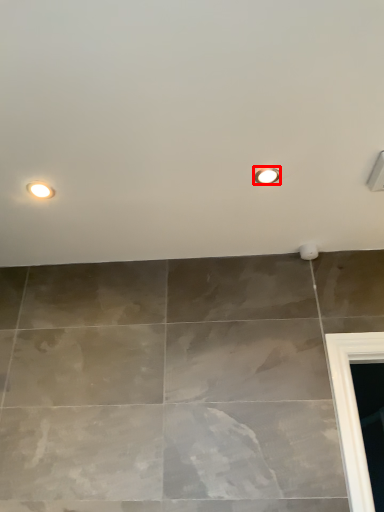
Question: From the image's perspective, what is the correct spatial relationship of droplight (annotated by the red box) in relation to droplight?

Choices:
 (A) above
 (B) below

Answer: (A)